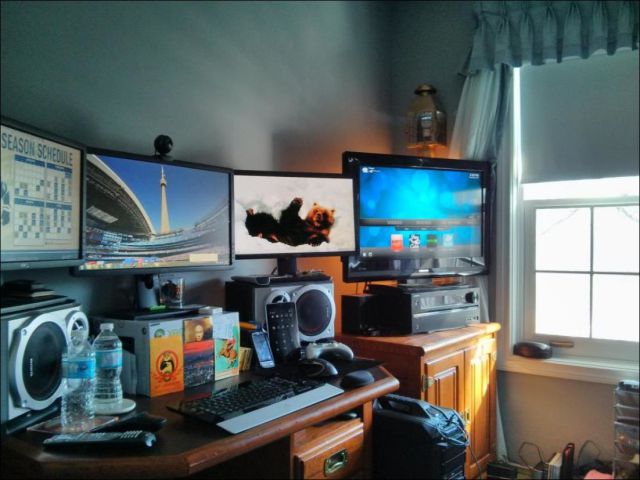
Locate an element on the screen. Image resolution: width=640 pixels, height=480 pixels. drawer is located at coordinates (336, 462).